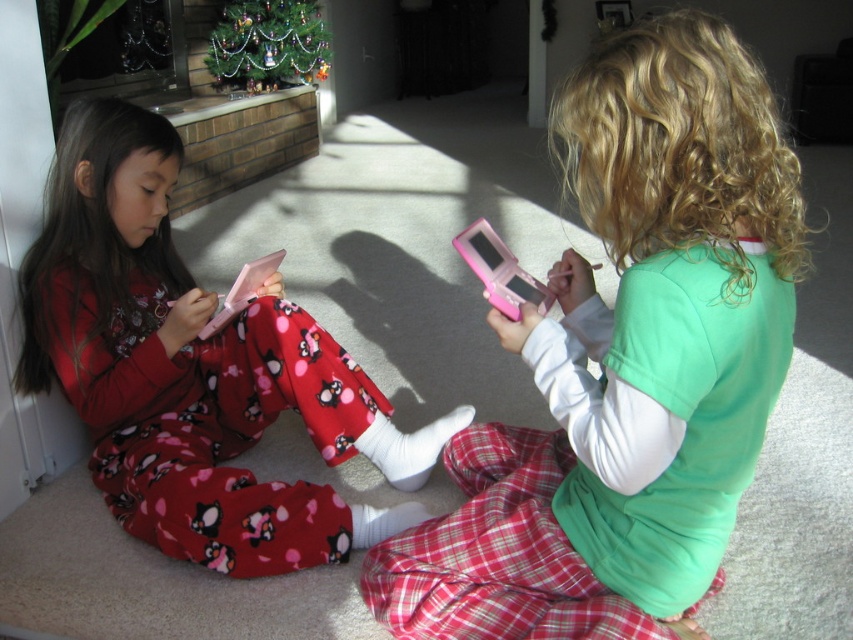
Question: Estimate the real-world distances between objects in this image. Which object is farther from the matte pink toy at center?

Choices:
 (A) pink plastic toy at center
 (B) matte pink tablet at left

Answer: (B)

Question: Can you confirm if matte pink toy at center is smaller than matte pink tablet at left?

Choices:
 (A) no
 (B) yes

Answer: (A)

Question: Can you confirm if matte pink toy at center is thinner than pink plastic toy at center?

Choices:
 (A) no
 (B) yes

Answer: (A)

Question: Considering the real-world distances, which object is farthest from the pink plastic toy at center?

Choices:
 (A) matte pink toy at center
 (B) matte pink tablet at left

Answer: (B)

Question: Estimate the real-world distances between objects in this image. Which object is closer to the matte pink tablet at left?

Choices:
 (A) matte pink toy at center
 (B) pink plastic toy at center

Answer: (A)

Question: Does matte pink toy at center have a greater width compared to matte pink tablet at left?

Choices:
 (A) yes
 (B) no

Answer: (B)